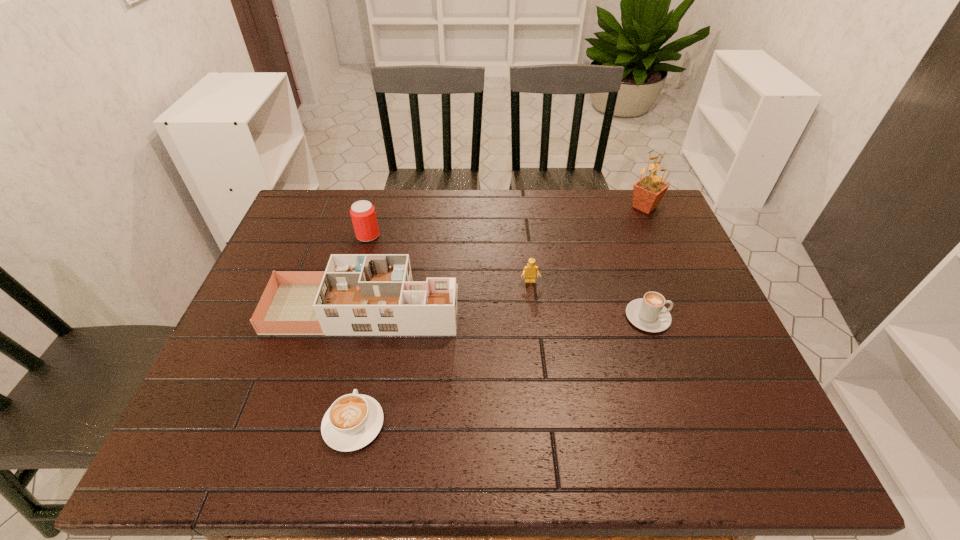
This screenshot has height=540, width=960. Identify the location of free space at the right edge. (668, 288).

Locate an element on the screen. This screenshot has height=540, width=960. vacant area at the near right corner of the desktop is located at coordinates (788, 465).

Find the location of a particular element. unoccupied position between the fifth nearest object and the fifth object from left to right is located at coordinates (508, 276).

Image resolution: width=960 pixels, height=540 pixels. In order to click on free space between the rightmost object and the dollhouse in this screenshot , I will do click(x=504, y=258).

What are the coordinates of `free space between the tallest object and the beer can` in the screenshot? It's located at (507, 221).

Image resolution: width=960 pixels, height=540 pixels. In order to click on free space between the nearest object and the tallest object in this screenshot , I will do `click(499, 315)`.

Find the location of a particular element. Image resolution: width=960 pixels, height=540 pixels. vacant area between the second farthest object and the third object from right to left is located at coordinates (449, 259).

Identify the location of free point between the nearer cappuccino and the fourth object from left to right. (442, 353).

At what (x,y) coordinates should I click in order to perform the action: click on vacant space in between the rightmost object and the dollhouse. Please return your answer as a coordinate pair (x, y). Image resolution: width=960 pixels, height=540 pixels. Looking at the image, I should click on (504, 258).

At what (x,y) coordinates should I click in order to perform the action: click on empty space that is in between the rightmost object and the Lego. Please return your answer as a coordinate pair (x, y). This screenshot has height=540, width=960. Looking at the image, I should click on (588, 244).